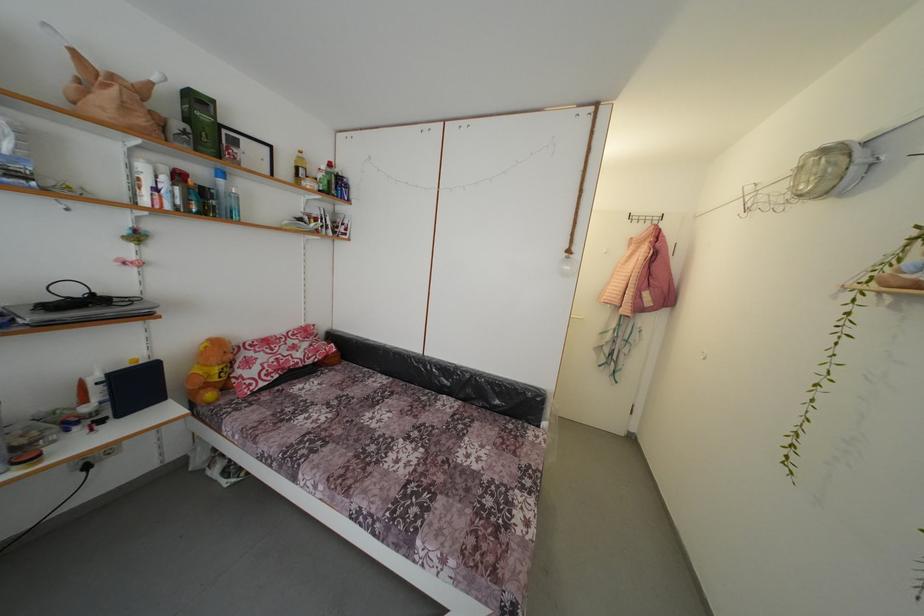
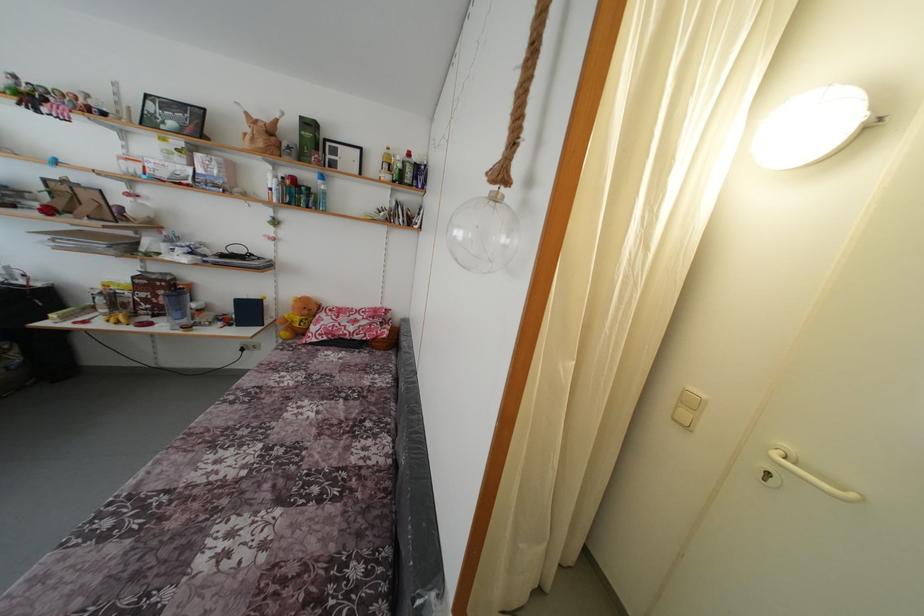
Where in the second image is the point corresponding to pixel 236 362 from the first image?

(310, 317)